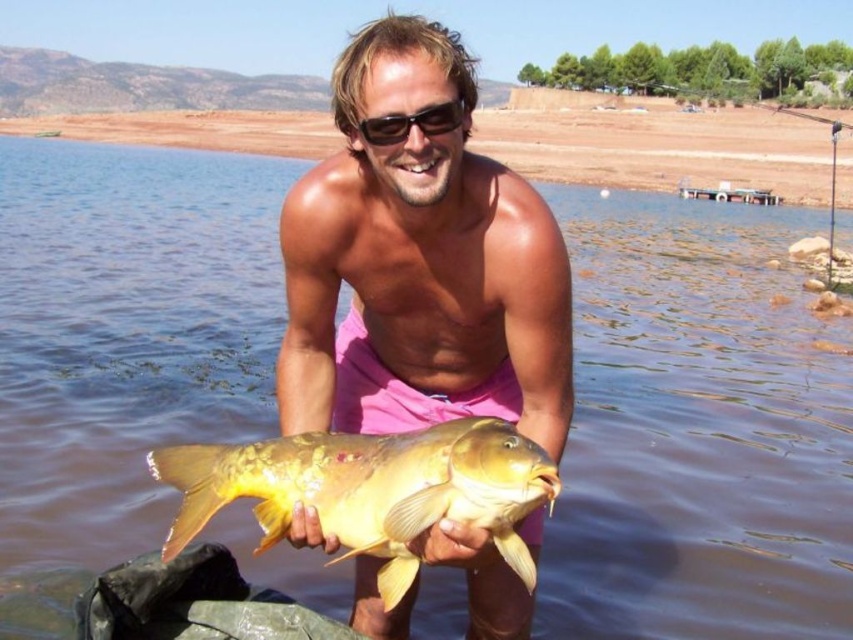
In the scene shown: Can you confirm if pink matte shorts at center is positioned to the left of black plastic sunglasses at center?

Incorrect, pink matte shorts at center is not on the left side of black plastic sunglasses at center.

Does pink matte shorts at center have a larger size compared to black plastic sunglasses at center?

Indeed, pink matte shorts at center has a larger size compared to black plastic sunglasses at center.

This screenshot has height=640, width=853. In order to click on pink matte shorts at center in this screenshot , I will do `click(421, 262)`.

Is the position of pink matte shorts at center more distant than that of golden matte fish at center?

Yes, pink matte shorts at center is behind golden matte fish at center.

Which of these two, pink matte shorts at center or golden matte fish at center, stands shorter?

golden matte fish at center is shorter.

Does point (358, 220) lie in front of point (419, 497)?

No.

Identify the location of pink matte shorts at center. The image size is (853, 640). (421, 262).

Does golden matte fish at center have a lesser width compared to black plastic sunglasses at center?

Incorrect, golden matte fish at center's width is not less than black plastic sunglasses at center's.

Is golden matte fish at center to the left of black plastic sunglasses at center from the viewer's perspective?

Yes, golden matte fish at center is to the left of black plastic sunglasses at center.

The image size is (853, 640). I want to click on golden matte fish at center, so click(x=370, y=490).

Identify the location of golden matte fish at center. (370, 490).